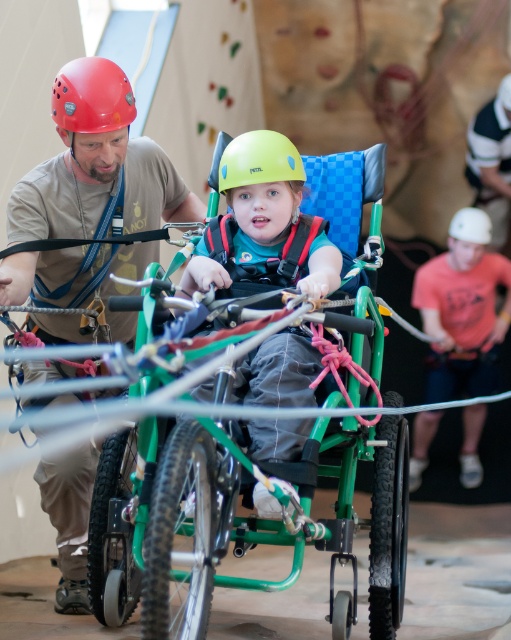
Question: Based on their relative distances, which object is farther from the matte green wheelchair at center?

Choices:
 (A) red matte helmet at upper left
 (B) matte red helmet at upper left

Answer: (B)

Question: Is matte red helmet at upper left smaller than white fabric at upper right?

Choices:
 (A) no
 (B) yes

Answer: (A)

Question: Can you confirm if red matte helmet at upper left is wider than white matte helmet at upper center?

Choices:
 (A) no
 (B) yes

Answer: (A)

Question: Can you confirm if orange t-shirt at right is bigger than white matte helmet at upper center?

Choices:
 (A) yes
 (B) no

Answer: (A)

Question: Which object is positioned closest to the matte green wheelchair at center?

Choices:
 (A) white fabric at upper right
 (B) green plastic tricycle at center
 (C) matte red helmet at upper left
 (D) white matte helmet at upper center

Answer: (B)

Question: Among these points, which one is nearest to the camera?

Choices:
 (A) (283, 289)
 (B) (248, 173)
 (C) (265, 388)

Answer: (C)